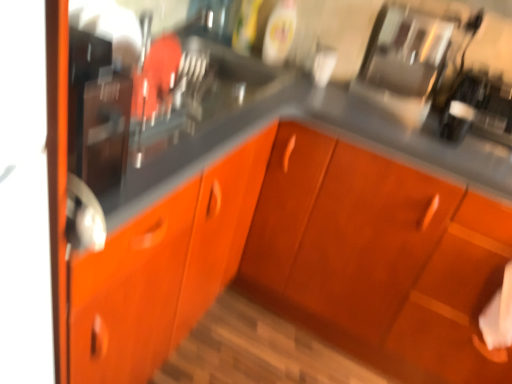
Question: Is matte black sink at left positioned far away from orange matte cabinet at center?

Choices:
 (A) yes
 (B) no

Answer: (B)

Question: Considering the relative sizes of matte black sink at left and orange matte cabinet at center in the image provided, is matte black sink at left thinner than orange matte cabinet at center?

Choices:
 (A) yes
 (B) no

Answer: (A)

Question: Does matte black sink at left lie in front of orange matte cabinet at center?

Choices:
 (A) yes
 (B) no

Answer: (B)

Question: Does matte black sink at left have a greater height compared to orange matte cabinet at center?

Choices:
 (A) no
 (B) yes

Answer: (A)

Question: Is orange matte cabinet at center surrounded by matte black sink at left?

Choices:
 (A) yes
 (B) no

Answer: (B)

Question: Does point (409, 105) appear closer or farther from the camera than point (275, 130)?

Choices:
 (A) closer
 (B) farther

Answer: (B)

Question: From a real-world perspective, is glossy stainless steel coffee maker at upper right physically located above or below orange matte cabinet at center?

Choices:
 (A) above
 (B) below

Answer: (A)

Question: Is glossy stainless steel coffee maker at upper right inside or outside of orange matte cabinet at center?

Choices:
 (A) outside
 (B) inside

Answer: (A)

Question: Is glossy stainless steel coffee maker at upper right in front of or behind orange matte cabinet at center in the image?

Choices:
 (A) behind
 (B) front

Answer: (A)

Question: Is orange matte cabinet at center taller or shorter than matte black sink at left?

Choices:
 (A) short
 (B) tall

Answer: (B)

Question: In terms of width, does orange matte cabinet at center look wider or thinner when compared to matte black sink at left?

Choices:
 (A) wide
 (B) thin

Answer: (A)

Question: Visually, is orange matte cabinet at center positioned to the left or to the right of matte black sink at left?

Choices:
 (A) left
 (B) right

Answer: (B)

Question: Relative to matte black sink at left, is orange matte cabinet at center in front or behind?

Choices:
 (A) behind
 (B) front

Answer: (B)

Question: In terms of height, does glossy stainless steel coffee maker at upper right look taller or shorter compared to matte black sink at left?

Choices:
 (A) short
 (B) tall

Answer: (A)

Question: Is point coord(404,29) positioned closer to the camera than point coord(100,134)?

Choices:
 (A) farther
 (B) closer

Answer: (A)